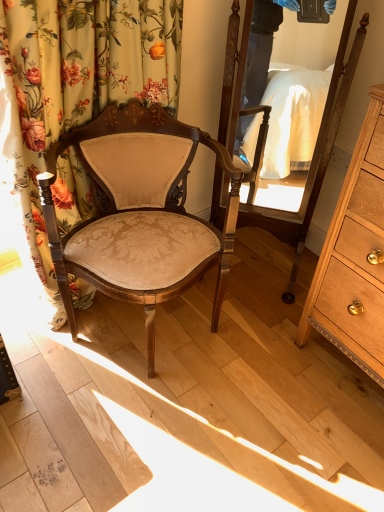
Question: Does light brown wood dresser at right have a smaller size compared to matte beige fabric chair at center?

Choices:
 (A) yes
 (B) no

Answer: (A)

Question: Does light brown wood dresser at right appear on the right side of matte beige fabric chair at center?

Choices:
 (A) yes
 (B) no

Answer: (A)

Question: Considering the relative sizes of light brown wood dresser at right and matte beige fabric chair at center in the image provided, is light brown wood dresser at right bigger than matte beige fabric chair at center?

Choices:
 (A) yes
 (B) no

Answer: (B)

Question: From a real-world perspective, is light brown wood dresser at right on top of matte beige fabric chair at center?

Choices:
 (A) no
 (B) yes

Answer: (B)

Question: Is light brown wood dresser at right surrounding matte beige fabric chair at center?

Choices:
 (A) yes
 (B) no

Answer: (B)

Question: From a real-world perspective, is light brown wood dresser at right located beneath matte beige fabric chair at center?

Choices:
 (A) no
 (B) yes

Answer: (A)

Question: From a real-world perspective, is wooden mirror at center located beneath floral fabric curtain at left?

Choices:
 (A) yes
 (B) no

Answer: (B)

Question: Is wooden mirror at center oriented away from floral fabric curtain at left?

Choices:
 (A) yes
 (B) no

Answer: (B)

Question: Would you say wooden mirror at center is outside floral fabric curtain at left?

Choices:
 (A) no
 (B) yes

Answer: (B)

Question: Is wooden mirror at center next to floral fabric curtain at left?

Choices:
 (A) yes
 (B) no

Answer: (B)

Question: From the image's perspective, is wooden mirror at center on floral fabric curtain at left?

Choices:
 (A) no
 (B) yes

Answer: (B)

Question: Does wooden mirror at center have a lesser height compared to floral fabric curtain at left?

Choices:
 (A) yes
 (B) no

Answer: (B)

Question: From a real-world perspective, is wooden mirror at center positioned over matte beige fabric chair at center based on gravity?

Choices:
 (A) no
 (B) yes

Answer: (B)